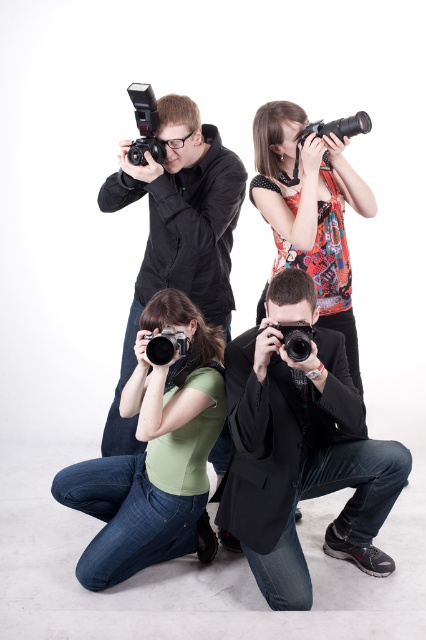
Question: Does green matte shirt at lower left appear under printed fabric top at upper right?

Choices:
 (A) yes
 (B) no

Answer: (A)

Question: Which of the following is the farthest from the observer?

Choices:
 (A) matte black camera at upper center
 (B) matte black camera at upper left
 (C) matte black camera at lower left
 (D) printed fabric top at upper right

Answer: (D)

Question: Which of the following is the closest to the observer?

Choices:
 (A) black matte camera at center
 (B) black plastic camera at upper left
 (C) black plastic camera at center

Answer: (C)

Question: Which of the following is the closest to the observer?

Choices:
 (A) matte black camera at lower left
 (B) green matte shirt at lower left

Answer: (A)

Question: From the image, what is the correct spatial relationship of black plastic camera at upper left in relation to matte black camera at lower left?

Choices:
 (A) above
 (B) below

Answer: (A)

Question: Does black matte camera at center have a smaller size compared to black plastic camera at center?

Choices:
 (A) no
 (B) yes

Answer: (A)